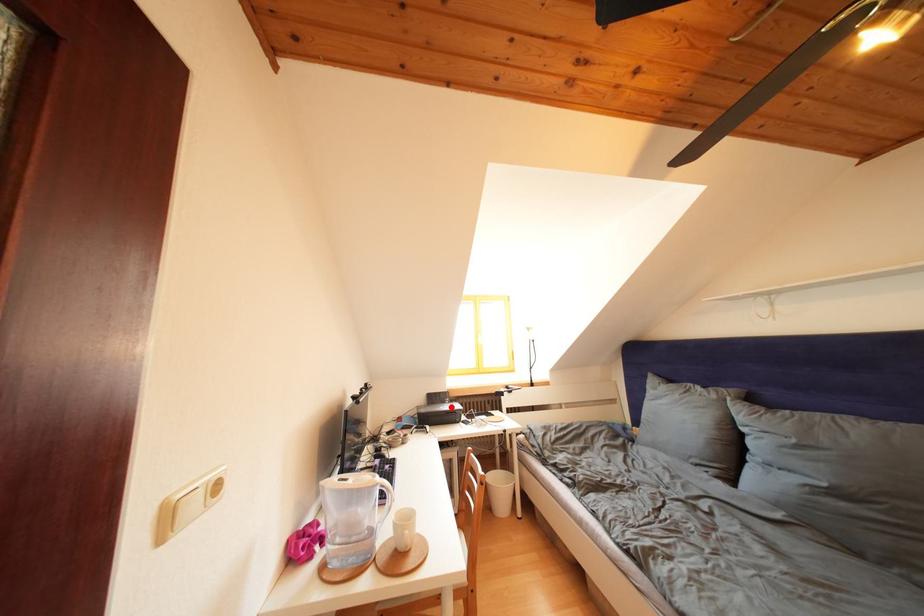
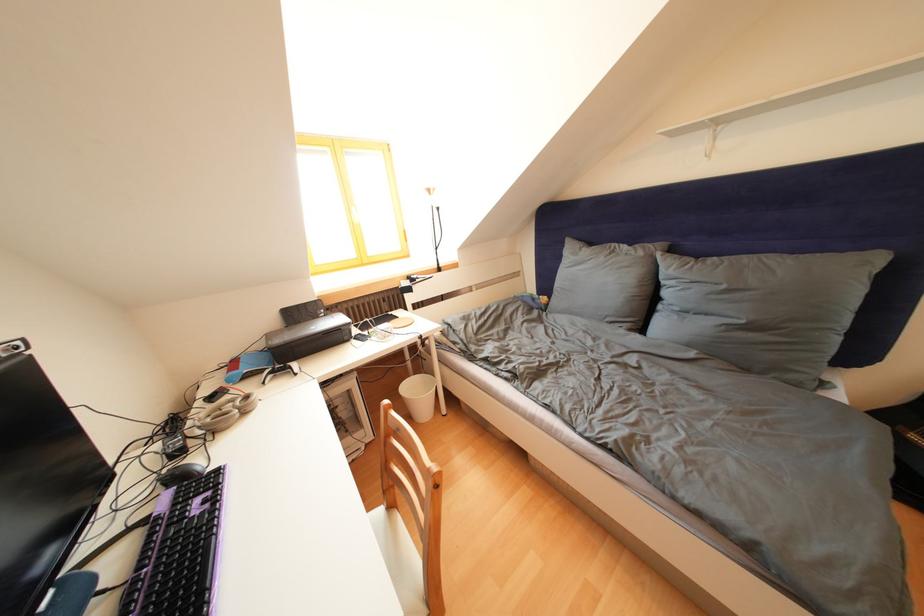
Question: A red point is marked in image1. In image2, is the corresponding 3D point closer to the camera or farther? Reply with the corresponding letter.

Choices:
 (A) The corresponding 3D point is closer.
 (B) The corresponding 3D point is farther.

Answer: (A)